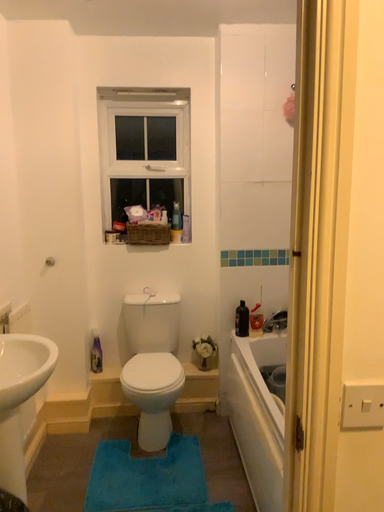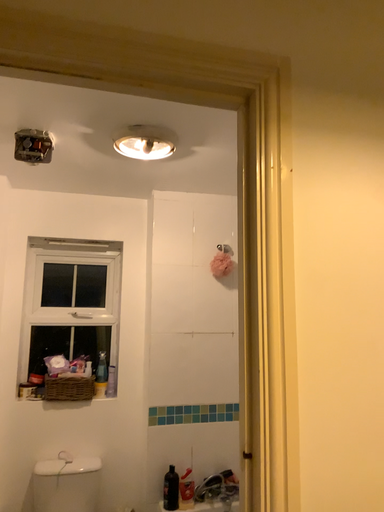
Question: Which way did the camera rotate in the video?

Choices:
 (A) rotated left
 (B) rotated right

Answer: (B)